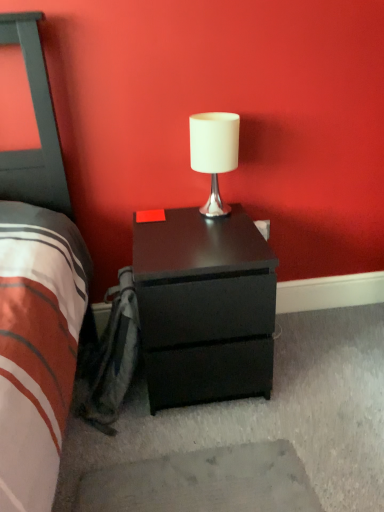
Question: From the image's perspective, is matte black nightstand at center positioned above or below white matte table lamp at center?

Choices:
 (A) below
 (B) above

Answer: (A)

Question: Is point (198, 395) positioned closer to the camera than point (203, 212)?

Choices:
 (A) closer
 (B) farther

Answer: (A)

Question: In the image, is matte black nightstand at center positioned in front of or behind white matte table lamp at center?

Choices:
 (A) front
 (B) behind

Answer: (A)

Question: From their relative heights in the image, would you say white matte table lamp at center is taller or shorter than matte black nightstand at center?

Choices:
 (A) short
 (B) tall

Answer: (A)

Question: Considering their positions, is white matte table lamp at center located in front of or behind matte black nightstand at center?

Choices:
 (A) behind
 (B) front

Answer: (A)

Question: Is white matte table lamp at center spatially inside matte black nightstand at center, or outside of it?

Choices:
 (A) inside
 (B) outside

Answer: (B)

Question: Considering the relative positions of white matte table lamp at center and matte black nightstand at center in the image provided, is white matte table lamp at center to the left or to the right of matte black nightstand at center?

Choices:
 (A) right
 (B) left

Answer: (A)